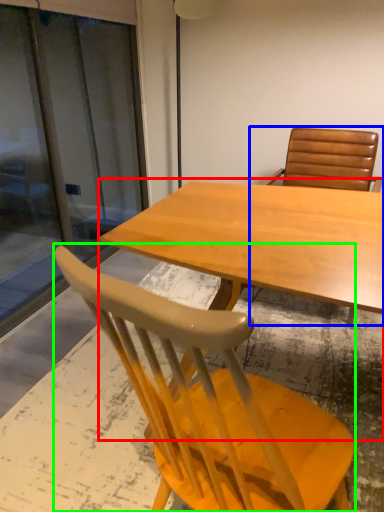
Question: Which is farther away from table (highlighted by a red box)? chair (highlighted by a blue box) or chair (highlighted by a green box)?

Choices:
 (A) chair
 (B) chair

Answer: (A)